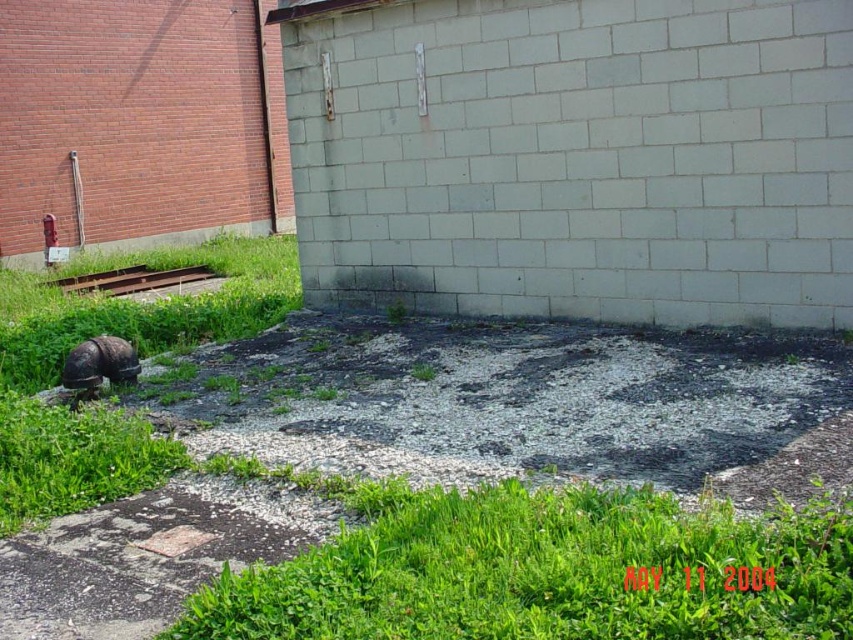
You are a gardener who needs to plant flowers in the green leafy grass at lower center and the smooth concrete patch at lower left. Which location would be more suitable for planting flowers and why?

The green leafy grass at lower center is more suitable for planting flowers because it has a greater height compared to the smooth concrete patch at lower left, providing better soil conditions for plant growth.

You are standing at the center of the image and want to place a small potted plant. The potted plant requires a spot with stable ground. Which area should you choose between the green leafy grass at lower center and the gravel near the red brick wall?

The green leafy grass at lower center has stable ground compared to the gravel near the red brick wall, so you should place the potted plant there.

You are a landscape architect designing a garden. You have two areas to consider for planting flowers. The green leafy grass at lower center and the smooth concrete patch at lower left. Which area has more space to accommodate larger flower beds?

The green leafy grass at lower center has more space to accommodate larger flower beds since it is larger in size than the smooth concrete patch at lower left.